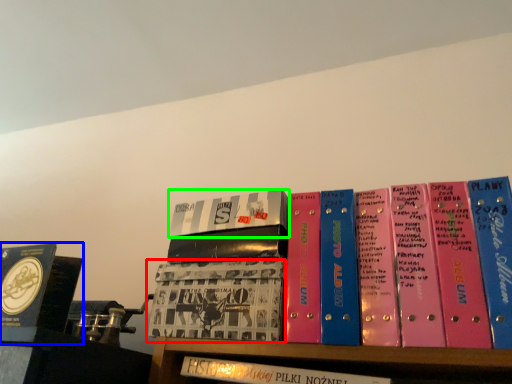
Question: Considering the real-world distances, which object is closest to book (highlighted by a red box)? book (highlighted by a blue box) or book (highlighted by a green box).

Choices:
 (A) book
 (B) book

Answer: (B)